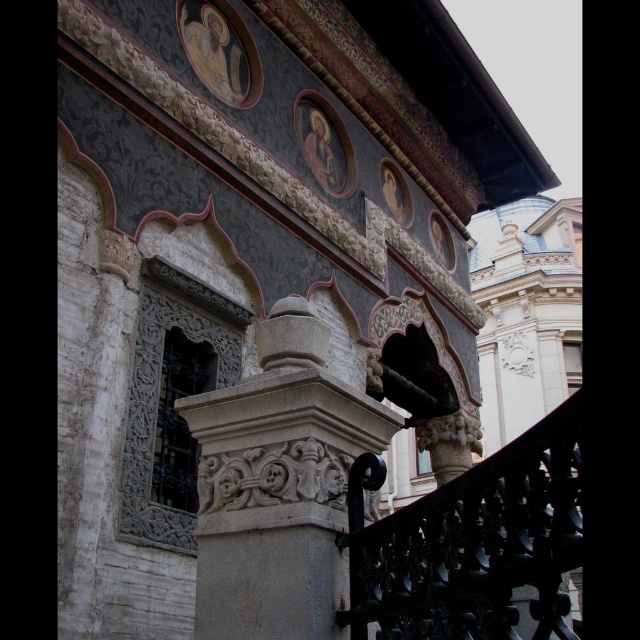
Does carved stone column at center have a lesser width compared to black wrought iron at lower right?

Yes.

Which is more to the right, carved stone column at center or black wrought iron at lower right?

black wrought iron at lower right

Where is `carved stone column at center`? The width and height of the screenshot is (640, 640). carved stone column at center is located at coordinates (278, 484).

You are a GUI agent. You are given a task and a screenshot of the screen. Output one action in this format:
    pyautogui.click(x=<x>, y=<y>)
    Task: Click on the carved stone column at center
    This screenshot has height=640, width=640.
    Given the screenshot: What is the action you would take?
    278,484